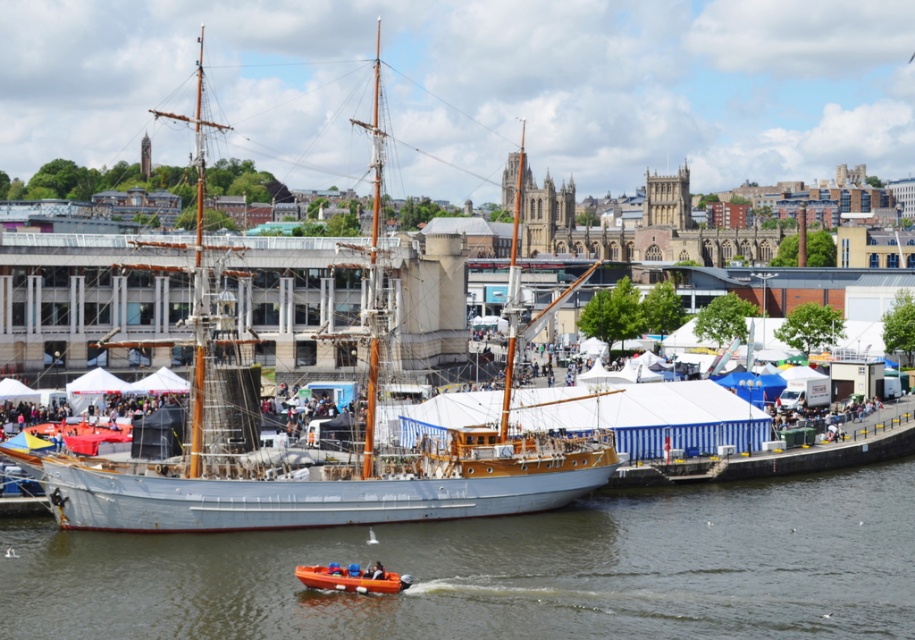
Between brown wooden boat at center and white wooden ship at center, which one has less height?

With less height is brown wooden boat at center.

Is brown wooden boat at center behind white wooden ship at center?

That is False.

Is point (315, 595) positioned in front of point (373, 182)?

Yes.

This screenshot has height=640, width=915. Identify the location of brown wooden boat at center. (504, 570).

Can you confirm if brown wooden boat at center is bigger than orange rubber dinghy at lower center?

Yes, brown wooden boat at center is bigger than orange rubber dinghy at lower center.

Between brown wooden boat at center and orange rubber dinghy at lower center, which one is positioned lower?

orange rubber dinghy at lower center is below.

Does point (734, 500) lie in front of point (348, 573)?

No, it is behind (348, 573).

In order to click on brown wooden boat at center in this screenshot , I will do `click(504, 570)`.

From the picture: Can you confirm if white wooden ship at center is shorter than orange rubber dinghy at lower center?

No.

Consider the image. Does white wooden ship at center have a smaller size compared to orange rubber dinghy at lower center?

No, white wooden ship at center is not smaller than orange rubber dinghy at lower center.

Which is behind, point (373, 392) or point (362, 579)?

Positioned behind is point (373, 392).

This screenshot has width=915, height=640. What are the coordinates of `white wooden ship at center` in the screenshot? It's located at (327, 480).